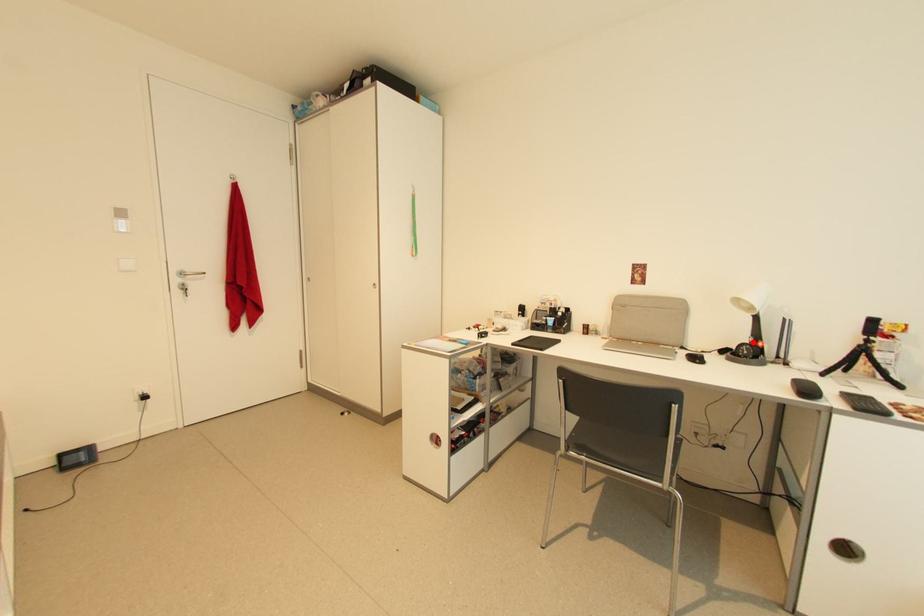
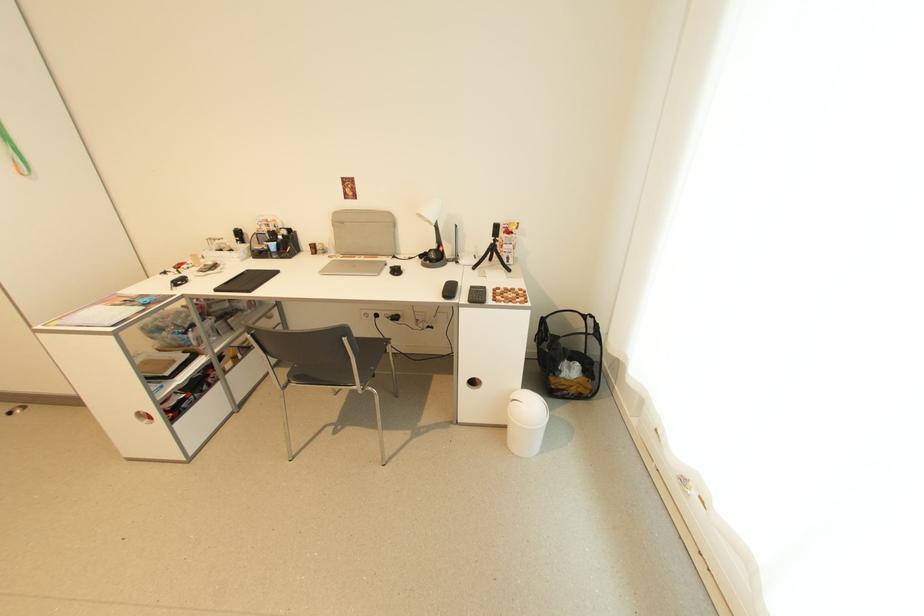
Question: I am providing you with two images of the same scene from different viewpoints. A red point is marked on the first image. Is the red point's position out of view in image 2?

Choices:
 (A) Yes
 (B) No

Answer: (B)